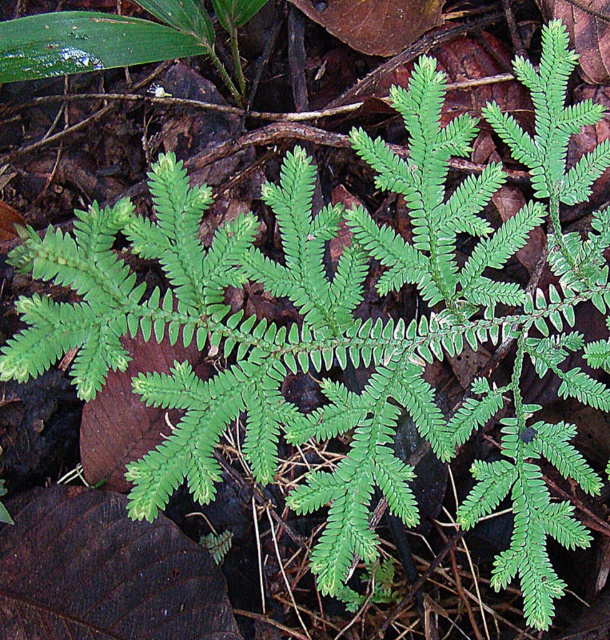
Question: Can you confirm if dark brown textured leaf at lower left is positioned below green matte leaf at upper left?

Choices:
 (A) no
 (B) yes

Answer: (B)

Question: Is dark brown textured leaf at lower left to the right of green matte leaf at upper left from the viewer's perspective?

Choices:
 (A) yes
 (B) no

Answer: (A)

Question: Which of the following is the farthest from the observer?

Choices:
 (A) (218, 602)
 (B) (79, 56)

Answer: (A)

Question: Is dark brown textured leaf at lower left positioned before green matte leaf at upper left?

Choices:
 (A) no
 (B) yes

Answer: (B)

Question: Which point is closer to the camera?

Choices:
 (A) (82, 67)
 (B) (77, 572)

Answer: (B)